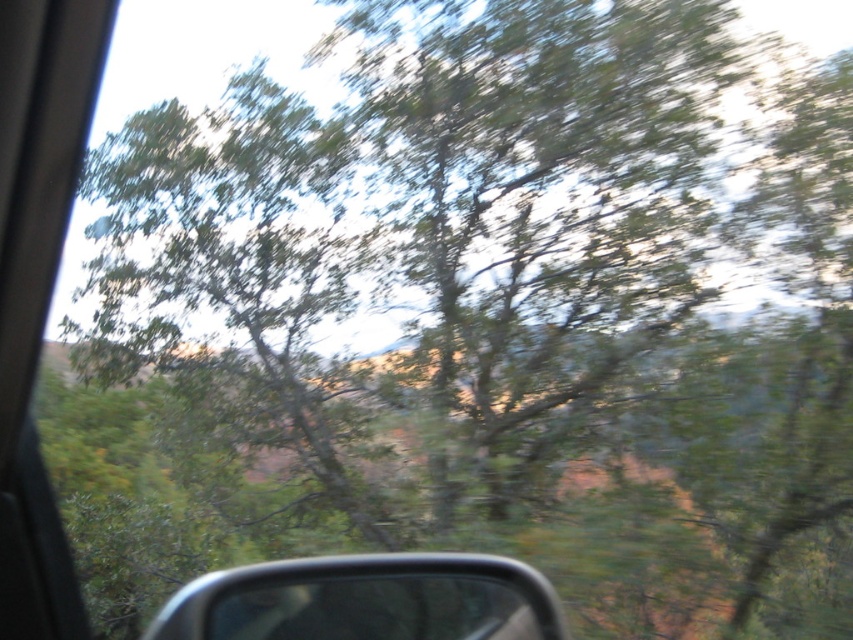
Who is positioned more to the left, green leafy tree at center or metallic gray side mirror at lower center?

From the viewer's perspective, green leafy tree at center appears more on the left side.

Consider the image. Can you confirm if green leafy tree at center is positioned above metallic gray side mirror at lower center?

Indeed, green leafy tree at center is positioned over metallic gray side mirror at lower center.

Locate an element on the screen. This screenshot has height=640, width=853. green leafy tree at center is located at coordinates (230, 273).

This screenshot has height=640, width=853. I want to click on green leafy tree at center, so click(x=230, y=273).